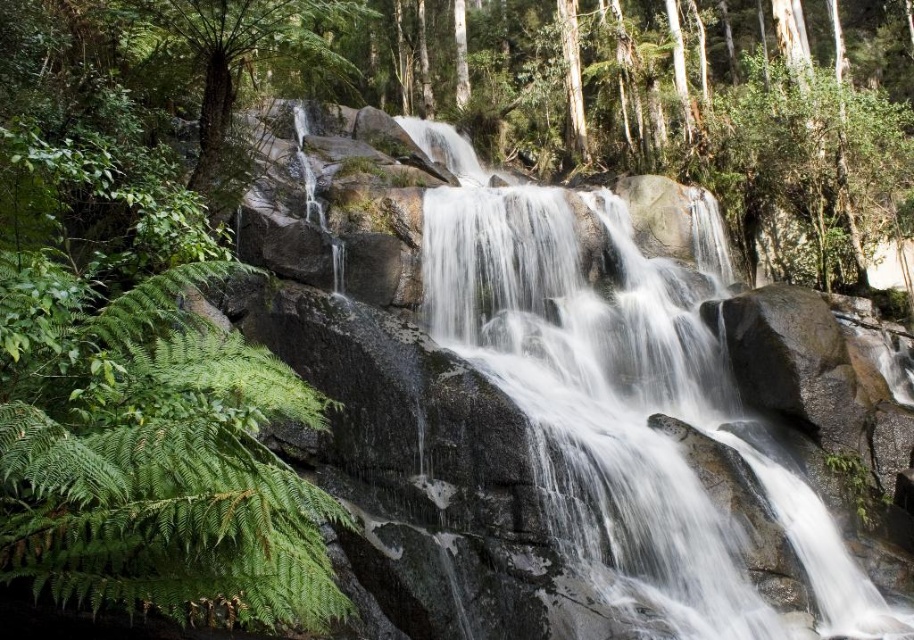
You are standing at the base of the waterfall and want to reach the green leafy tree at left. Which direction should you move relative to the smooth gray rock at center?

To reach the green leafy tree at left from the base of the waterfall, you should move toward the left side since the smooth gray rock at center is located below the green leafy tree at left, indicating the tree is positioned above and to the left relative to the rock.

You are a hiker who wants to cross a small stream between the smooth gray rock at center and the green leafy tree at left. The stream is 25 feet wide. Can you safely cross the stream using a 30 feet long wooden plank?

The distance between the smooth gray rock at center and the green leafy tree at left is 27.90 feet. Since the wooden plank is 30 feet long, which is longer than the 27.90 feet gap, you can safely place the plank across the stream and cross it without any issues.

You are a hiker who wants to place a 3.5 meter long wooden bench between the green leafy fern at left and the waterfall. Will the bench fit without overlapping either of them?

The green leafy fern at left and the waterfall are 4.09 meters apart. Since the bench is 3.5 meters long, it will fit between them without overlapping either.